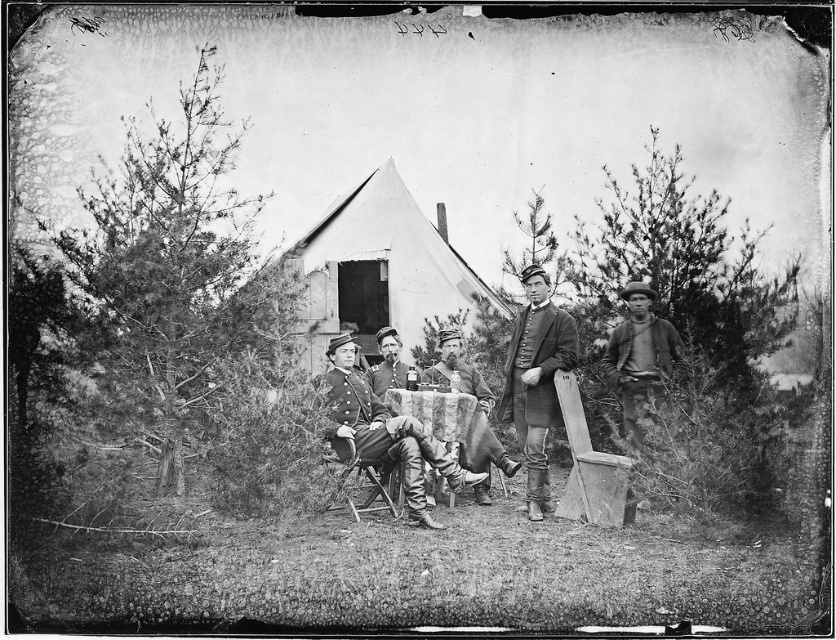
Is the position of white canvas tent at center more distant than that of smooth leather hat at center?

No, it is not.

Can you confirm if white canvas tent at center is taller than smooth leather hat at center?

Indeed, white canvas tent at center has a greater height compared to smooth leather hat at center.

The height and width of the screenshot is (640, 836). I want to click on white canvas tent at center, so [x=376, y=272].

Does matte gray uniform at center have a greater width compared to rugged brown shirt at right?

Correct, the width of matte gray uniform at center exceeds that of rugged brown shirt at right.

You are a GUI agent. You are given a task and a screenshot of the screen. Output one action in this format:
    pyautogui.click(x=<x>, y=<y>)
    Task: Click on the matte gray uniform at center
    The width and height of the screenshot is (836, 640).
    Given the screenshot: What is the action you would take?
    [x=536, y=380]

Is rustic wood chair at center smaller than smooth leather hat at center?

Incorrect, rustic wood chair at center is not smaller in size than smooth leather hat at center.

Is rustic wood chair at center shorter than smooth leather hat at center?

Incorrect, rustic wood chair at center's height does not fall short of smooth leather hat at center's.

Does point (467, 449) lie behind point (376, 394)?

No, (467, 449) is in front of (376, 394).

You are a GUI agent. You are given a task and a screenshot of the screen. Output one action in this format:
    pyautogui.click(x=<x>, y=<y>)
    Task: Click on the rustic wood chair at center
    This screenshot has width=836, height=640.
    Given the screenshot: What is the action you would take?
    pyautogui.click(x=473, y=410)